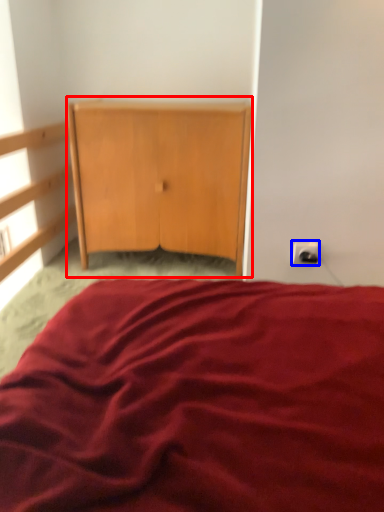
Question: Which object is closer to the camera taking this photo, cupboard (highlighted by a red box) or electric outlet (highlighted by a blue box)?

Choices:
 (A) cupboard
 (B) electric outlet

Answer: (B)